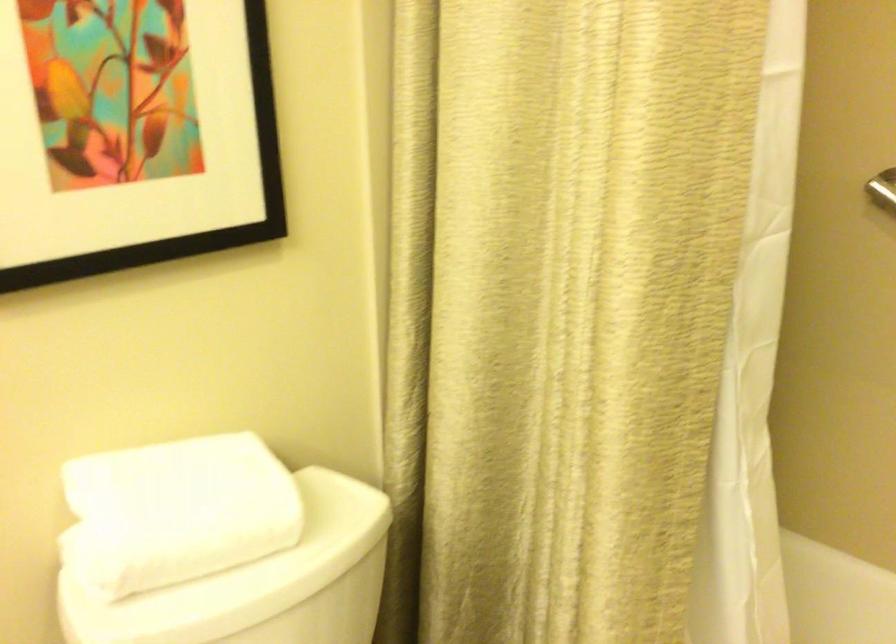
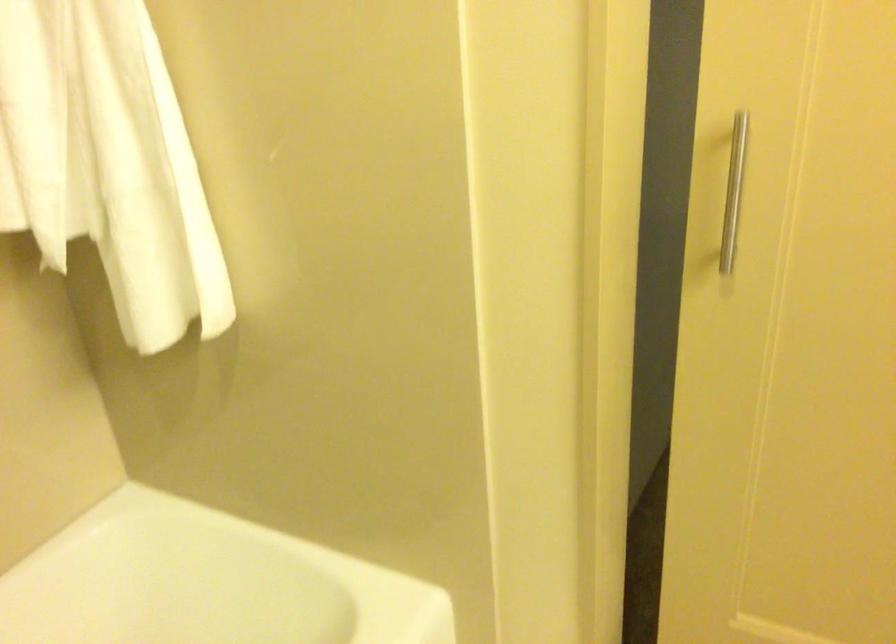
Based on the continuous images, in which direction is the camera rotating?

The camera rotated toward right-down.